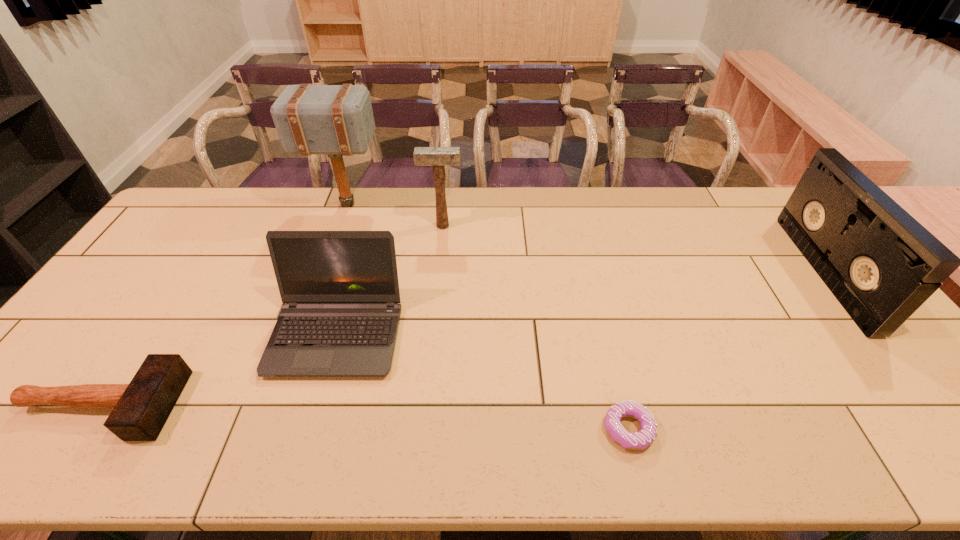
The image size is (960, 540). Identify the location of the second mallet from left to right. (337, 120).

The height and width of the screenshot is (540, 960). I want to click on the tallest mallet, so click(337, 120).

Find the location of a particular element. This screenshot has width=960, height=540. the fourth object from left to right is located at coordinates pos(438,157).

The height and width of the screenshot is (540, 960). Identify the location of the rightmost mallet. (438, 157).

Image resolution: width=960 pixels, height=540 pixels. Identify the location of videotape. (881, 264).

What are the coordinates of `laptop_computer` in the screenshot? It's located at (341, 317).

At what (x,y) coordinates should I click in order to perform the action: click on the shortest object. Please return your answer as a coordinate pair (x, y). Looking at the image, I should click on (643, 438).

I want to click on doughnut, so [643, 438].

This screenshot has height=540, width=960. I want to click on free spot located on the striking surface of the tallest mallet, so click(444, 204).

The width and height of the screenshot is (960, 540). I want to click on free spot located on the front of the third object from right to left, so click(434, 316).